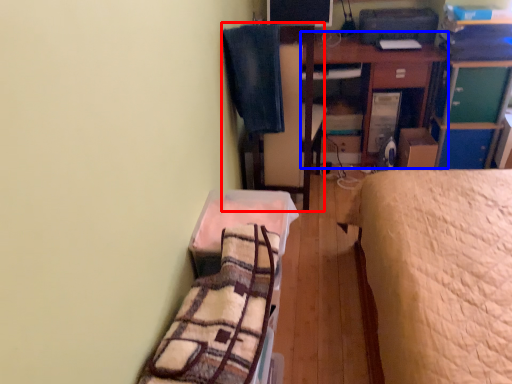
Question: Which point is closer to the camera, swivel chair (highlighted by a red box) or table (highlighted by a blue box)?

Choices:
 (A) swivel chair
 (B) table

Answer: (A)